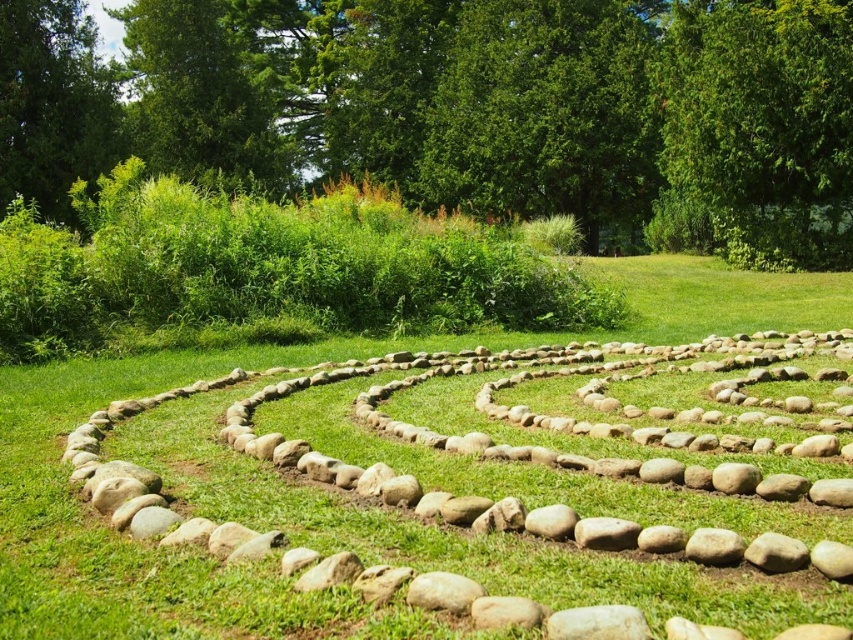
Which is above, smooth gray rock at center or smooth gray rock at lower right?

Positioned higher is smooth gray rock at lower right.

Based on the photo, can you confirm if smooth gray rock at center is taller than smooth gray rock at lower right?

In fact, smooth gray rock at center may be shorter than smooth gray rock at lower right.

Which is behind, point (440, 579) or point (753, 552)?

Positioned behind is point (753, 552).

Locate an element on the screen. smooth gray rock at center is located at coordinates (442, 592).

Does point (738, 536) lie in front of point (473, 600)?

That is False.

Does point (566, 516) come behind point (430, 595)?

Yes, it is behind point (430, 595).

From the picture: Who is more forward, (363,570) or (430,572)?

Point (430,572) is more forward.

Image resolution: width=853 pixels, height=640 pixels. What are the coordinates of `natural stone at center` in the screenshot? It's located at (490, 483).

Who is taller, natural stone at center or smooth gray rock at lower right?

natural stone at center

Does natural stone at center appear on the right side of smooth gray rock at lower right?

In fact, natural stone at center is to the left of smooth gray rock at lower right.

Describe the element at coordinates (490, 483) in the screenshot. The image size is (853, 640). I see `natural stone at center` at that location.

Locate an element on the screen. This screenshot has width=853, height=640. natural stone at center is located at coordinates (490, 483).